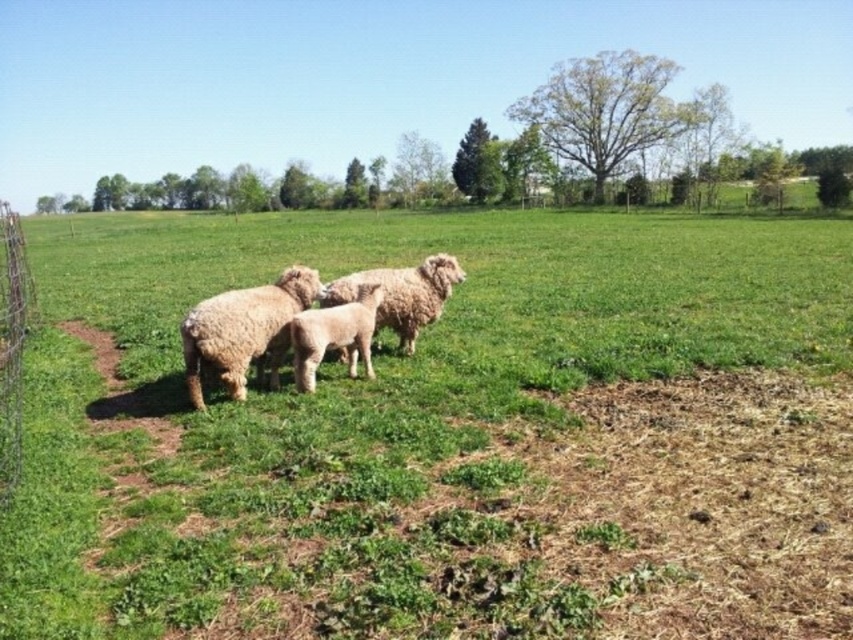
Between wire mesh fence at left and fuzzy white sheep at center, which one appears on the left side from the viewer's perspective?

From the viewer's perspective, wire mesh fence at left appears more on the left side.

Can you confirm if wire mesh fence at left is smaller than fuzzy white sheep at center?

No.

This screenshot has height=640, width=853. Identify the location of wire mesh fence at left. (10, 340).

Locate an element on the screen. The height and width of the screenshot is (640, 853). wire mesh fence at left is located at coordinates (10, 340).

Who is positioned more to the right, green soft grass at center or fuzzy beige sheep at center?

From the viewer's perspective, fuzzy beige sheep at center appears more on the right side.

Which is behind, point (566, 397) or point (305, 301)?

The point (305, 301) is more distant.

Between point (289, 432) and point (231, 387), which one is positioned in front?

Point (289, 432) is more forward.

Identify the location of green soft grass at center. (447, 436).

Which is in front, point (1, 369) or point (367, 340)?

Positioned in front is point (367, 340).

Locate an element on the screen. wire mesh fence at left is located at coordinates (10, 340).